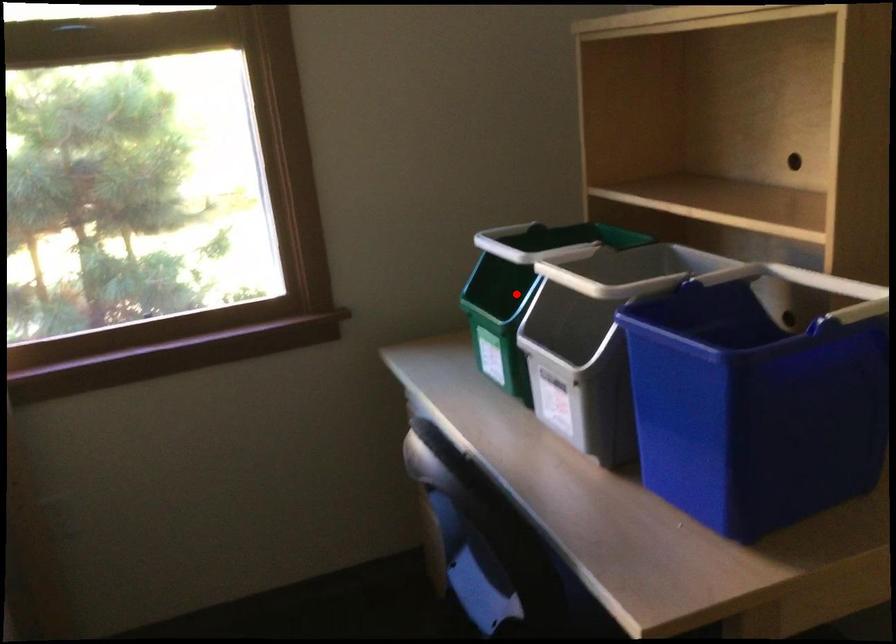
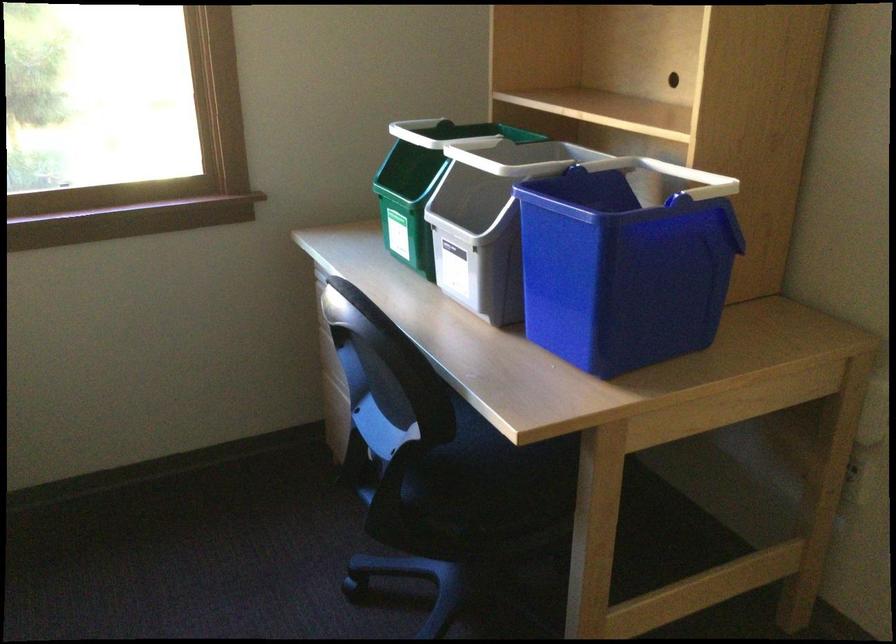
The point at the highlighted location is marked in the first image. Where is the corresponding point in the second image?

(421, 184)